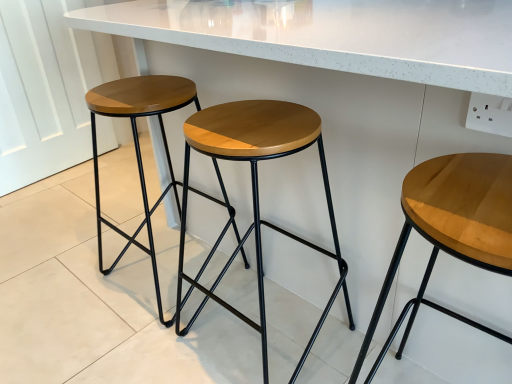
Question: Is point (493, 175) positioned closer to the camera than point (120, 251)?

Choices:
 (A) farther
 (B) closer

Answer: (B)

Question: Is light brown wood stool at center, acting as the 3th stool starting from the left, wider or thinner than wooden seat at center, placed as the 3th stool when sorted from right to left?

Choices:
 (A) wide
 (B) thin

Answer: (A)

Question: Considering the real-world distances, which object is closest to the wooden seat at center, which ranks as the 1th stool in left-to-right order?

Choices:
 (A) wooden/matte stool at center, which is counted as the 2th stool, starting from the right
 (B) light brown wood stool at center, acting as the 1th stool starting from the right

Answer: (A)

Question: Estimate the real-world distances between objects in this image. Which object is farther from the light brown wood stool at center, acting as the 3th stool starting from the left?

Choices:
 (A) wooden seat at center, placed as the 3th stool when sorted from right to left
 (B) wooden/matte stool at center, positioned as the second stool in left-to-right order

Answer: (A)